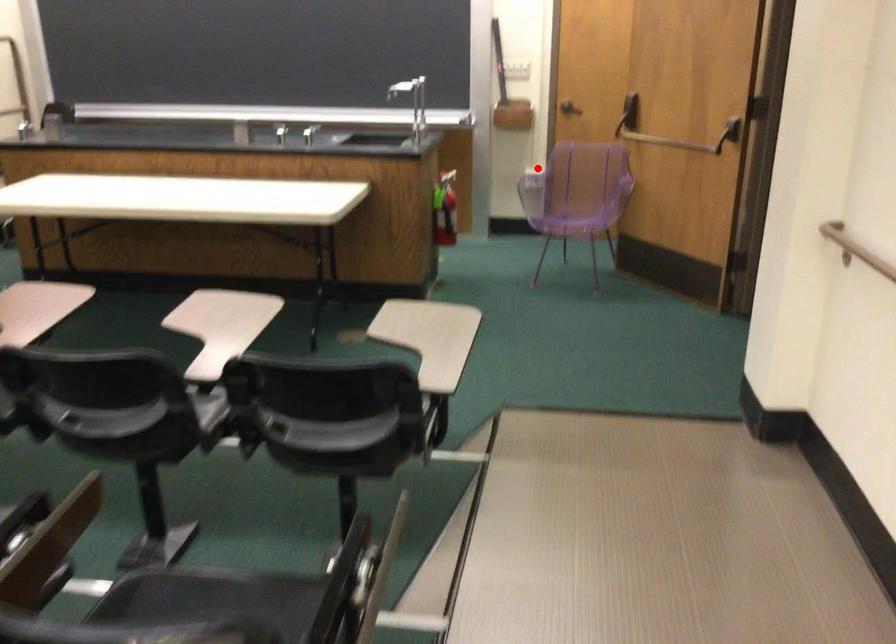
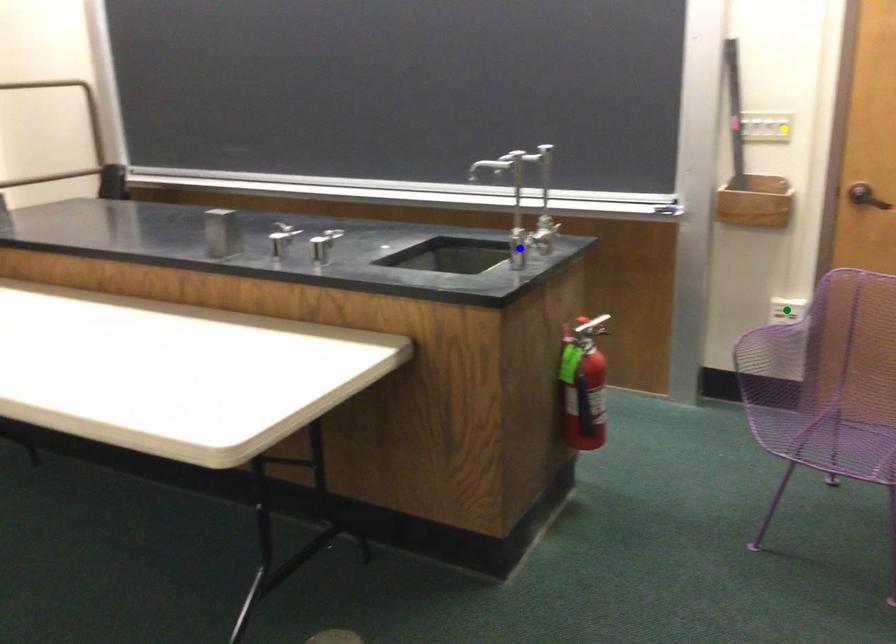
Question: I am providing you with two images of the same scene from different viewpoints. A red point is marked on the first image. You are given multiple points on the second image. Which mark in image 2 goes with the point in image 1?

Choices:
 (A) green point
 (B) yellow point
 (C) blue point

Answer: (A)